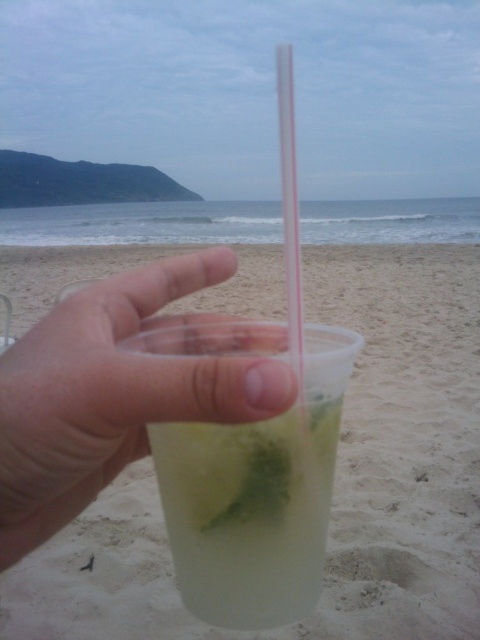
You are at a beach bar and want to order a drink. The bartender asks if you prefer a drink in a clear plastic cup at center or a transparent plastic straw at center. Based on their sizes, which one would you choose if you want the larger container?

The transparent plastic straw at center is larger than the clear plastic cup at center, so you should choose the transparent plastic straw at center if you want the larger container.

You are standing on the beach and see two points marked in the image. Which point is closer to you, point [204,320] or point [282,496]?

Point [204,320] is closer to you because it is further to the viewer than point [282,496].

You are a bartender preparing a drink for a customer who wants a mojito. You have a translucent plastic cup at center and a transparent plastic straw at center. How far apart are these two items on the counter?

The translucent plastic cup at center is 3.92 feet away from the transparent plastic straw at center.